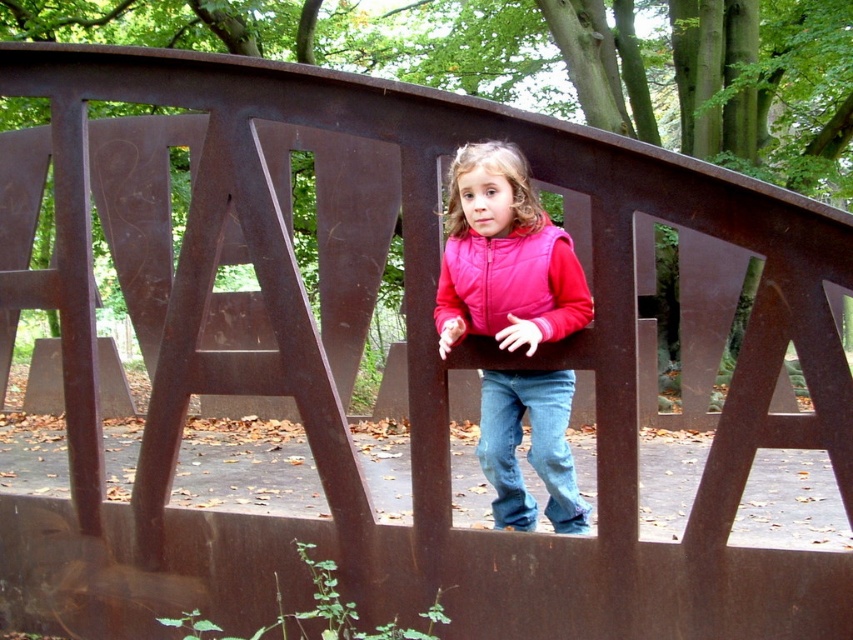
Question: Which point appears farthest from the camera in this image?

Choices:
 (A) (480, 312)
 (B) (503, 237)
 (C) (485, 388)

Answer: (C)

Question: Can you confirm if pink quilted vest at center is wider than jeans at center?

Choices:
 (A) yes
 (B) no

Answer: (A)

Question: Which of the following is the farthest from the observer?

Choices:
 (A) (543, 451)
 (B) (572, 275)

Answer: (A)

Question: From the image, what is the correct spatial relationship of pink matte vest at center in relation to pink quilted vest at center?

Choices:
 (A) right
 (B) left

Answer: (A)

Question: Estimate the real-world distances between objects in this image. Which object is farther from the jeans at center?

Choices:
 (A) pink matte vest at center
 (B) pink quilted vest at center

Answer: (B)

Question: Can you confirm if pink matte vest at center is positioned to the left of jeans at center?

Choices:
 (A) yes
 (B) no

Answer: (A)